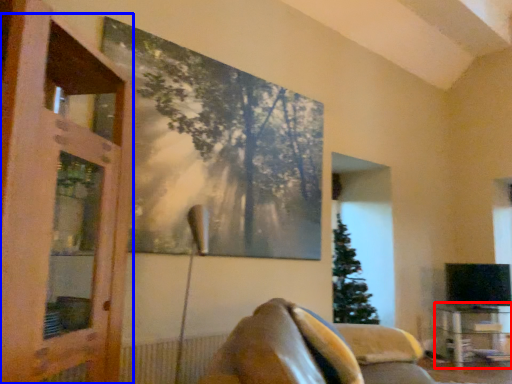
Question: Which object appears farthest to the camera in this image, table (highlighted by a red box) or screen door (highlighted by a blue box)?

Choices:
 (A) table
 (B) screen door

Answer: (A)